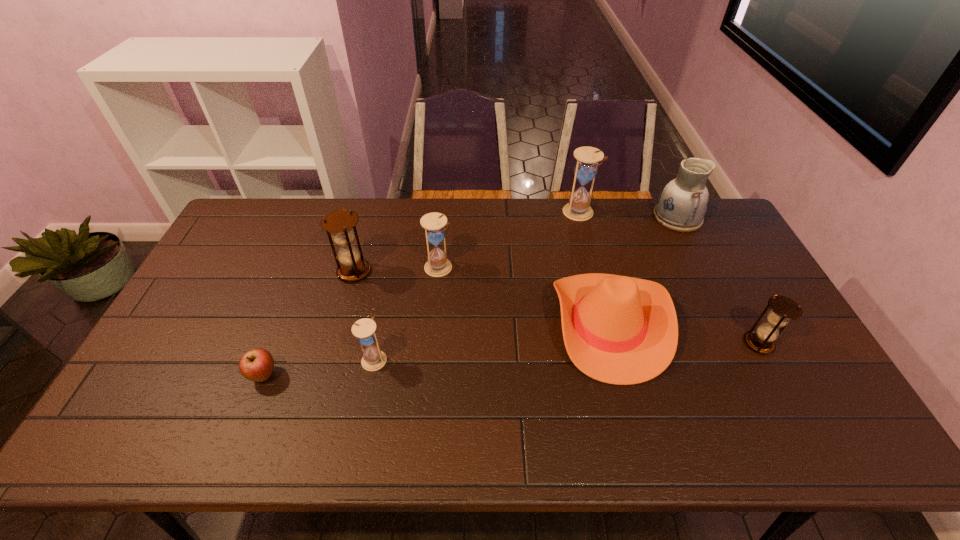
Identify the location of vacant space that satisfies the following two spatial constraints: 1. on the back side of the nearer brown hourglass; 2. on the left side of the leftmost object. Image resolution: width=960 pixels, height=540 pixels. (276, 344).

This screenshot has width=960, height=540. I want to click on vacant region that satisfies the following two spatial constraints: 1. on the back side of the leftmost white hourglass; 2. on the left side of the fourth hourglass from left to right, so click(403, 213).